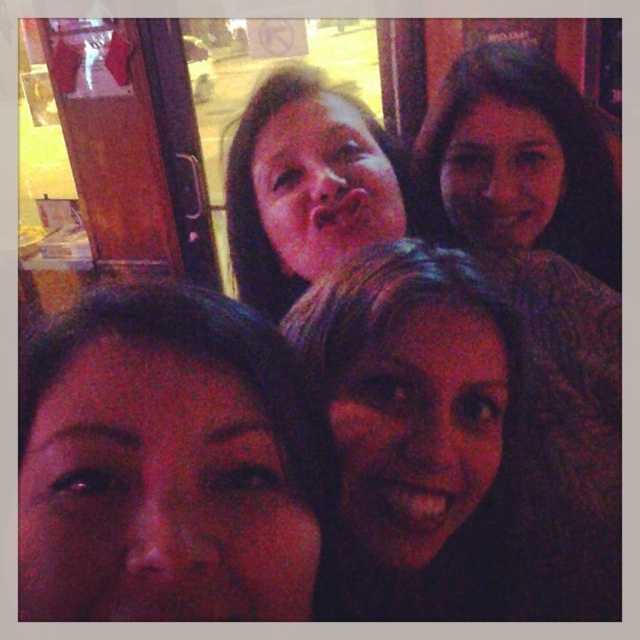
Question: From the image, what is the correct spatial relationship of dark hair at upper right in relation to matte skin at center?

Choices:
 (A) right
 (B) left

Answer: (A)

Question: Estimate the real-world distances between objects in this image. Which object is farther from the dark brown hair at upper right?

Choices:
 (A) matte skin at center
 (B) dark hair at upper right

Answer: (A)

Question: Can you confirm if dark hair at upper right is thinner than dark brown hair at upper right?

Choices:
 (A) no
 (B) yes

Answer: (B)

Question: Can you confirm if dark hair at upper right is positioned below dark brown hair at upper right?

Choices:
 (A) no
 (B) yes

Answer: (B)

Question: Based on their relative distances, which object is nearer to the matte skin at center?

Choices:
 (A) dark hair at upper right
 (B) dark brown hair at upper right

Answer: (A)

Question: Which object appears closest to the camera in this image?

Choices:
 (A) dark hair at upper right
 (B) dark brown hair at upper right
 (C) matte skin at center

Answer: (C)